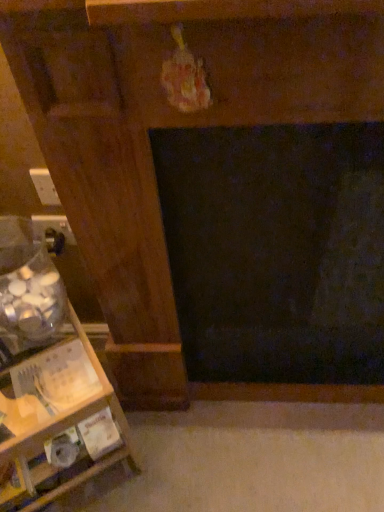
Locate an element on the screen. The height and width of the screenshot is (512, 384). wooden shelf at left is located at coordinates (57, 419).

Find the location of a particular element. wooden shelf at left is located at coordinates (57, 419).

Which is more to the left, wooden shelf at left or matte black outlet at lower left, which ranks as the first electric outlet in bottom-to-top order?

From the viewer's perspective, wooden shelf at left appears more on the left side.

Looking at this image, is wooden shelf at left thinner than matte black outlet at lower left, the first electric outlet when ordered from back to front?

In fact, wooden shelf at left might be wider than matte black outlet at lower left, the first electric outlet when ordered from back to front.

Who is bigger, wooden shelf at left or matte black outlet at lower left, the first electric outlet when ordered from back to front?

wooden shelf at left.

Can you tell me how much wooden shelf at left and matte black outlet at lower left, which is counted as the second electric outlet, starting from the top, differ in facing direction?

34.1 degrees separate the facing orientations of wooden shelf at left and matte black outlet at lower left, which is counted as the second electric outlet, starting from the top.

Can you confirm if wooden shelf at left is smaller than white plastic electric outlet at left, which is the second electric outlet in back-to-front order?

Incorrect, wooden shelf at left is not smaller in size than white plastic electric outlet at left, which is the second electric outlet in back-to-front order.

Does wooden shelf at left lie behind white plastic electric outlet at left, which is the first electric outlet from front to back?

No, wooden shelf at left is closer to the camera.

Is wooden shelf at left not near white plastic electric outlet at left, which is the first electric outlet from front to back?

No, wooden shelf at left is in close proximity to white plastic electric outlet at left, which is the first electric outlet from front to back.

Is white plastic electric outlet at left, marked as the second electric outlet in a bottom-to-top arrangement, at the back of wooden shelf at left?

No, wooden shelf at left is not facing the opposite direction of white plastic electric outlet at left, marked as the second electric outlet in a bottom-to-top arrangement.

Is white plastic electric outlet at left, marked as the second electric outlet in a bottom-to-top arrangement, positioned with its back to matte black outlet at lower left, the first electric outlet when ordered from back to front?

No, white plastic electric outlet at left, marked as the second electric outlet in a bottom-to-top arrangement, is not facing away from matte black outlet at lower left, the first electric outlet when ordered from back to front.

Who is taller, white plastic electric outlet at left, which is the second electric outlet in back-to-front order, or matte black outlet at lower left, which is counted as the second electric outlet, starting from the top?

With more height is white plastic electric outlet at left, which is the second electric outlet in back-to-front order.

Measure the distance between white plastic electric outlet at left, marked as the second electric outlet in a bottom-to-top arrangement, and matte black outlet at lower left, which is counted as the second electric outlet, starting from the top.

white plastic electric outlet at left, marked as the second electric outlet in a bottom-to-top arrangement, is 2.74 inches from matte black outlet at lower left, which is counted as the second electric outlet, starting from the top.

Who is bigger, white plastic electric outlet at left, marked as the second electric outlet in a bottom-to-top arrangement, or matte black outlet at lower left, the 2th electric outlet viewed from the front?

With larger size is matte black outlet at lower left, the 2th electric outlet viewed from the front.

From the image's perspective, would you say white plastic electric outlet at left, which is the second electric outlet in back-to-front order, is positioned over wooden shelf at left?

Indeed, from the image's perspective, white plastic electric outlet at left, which is the second electric outlet in back-to-front order, is shown above wooden shelf at left.

Which is less distant, (50, 186) or (61, 345)?

Point (50, 186) appears to be closer to the viewer than point (61, 345).

Is white plastic electric outlet at left, placed as the first electric outlet when sorted from top to bottom, with wooden shelf at left?

They are not placed beside each other.

Considering the sizes of objects white plastic electric outlet at left, marked as the second electric outlet in a bottom-to-top arrangement, and wooden shelf at left in the image provided, who is shorter, white plastic electric outlet at left, marked as the second electric outlet in a bottom-to-top arrangement, or wooden shelf at left?

With less height is white plastic electric outlet at left, marked as the second electric outlet in a bottom-to-top arrangement.

Between matte black outlet at lower left, which is counted as the second electric outlet, starting from the top, and white plastic electric outlet at left, marked as the second electric outlet in a bottom-to-top arrangement, which one has smaller size?

white plastic electric outlet at left, marked as the second electric outlet in a bottom-to-top arrangement.

Is matte black outlet at lower left, the 2th electric outlet viewed from the front, in contact with white plastic electric outlet at left, marked as the second electric outlet in a bottom-to-top arrangement?

Yes, matte black outlet at lower left, the 2th electric outlet viewed from the front, is beside white plastic electric outlet at left, marked as the second electric outlet in a bottom-to-top arrangement.

Is matte black outlet at lower left, the first electric outlet when ordered from back to front, positioned with its back to white plastic electric outlet at left, placed as the first electric outlet when sorted from top to bottom?

No, matte black outlet at lower left, the first electric outlet when ordered from back to front, is not facing the opposite direction of white plastic electric outlet at left, placed as the first electric outlet when sorted from top to bottom.

Visually, is matte black outlet at lower left, which is counted as the second electric outlet, starting from the top, positioned to the left or to the right of white plastic electric outlet at left, placed as the first electric outlet when sorted from top to bottom?

Clearly, matte black outlet at lower left, which is counted as the second electric outlet, starting from the top, is on the left of white plastic electric outlet at left, placed as the first electric outlet when sorted from top to bottom, in the image.

Consider the image. Is matte black outlet at lower left, which ranks as the first electric outlet in bottom-to-top order, to the left or to the right of wooden shelf at left in the image?

matte black outlet at lower left, which ranks as the first electric outlet in bottom-to-top order, is positioned on wooden shelf at left's right side.

Can you confirm if matte black outlet at lower left, which ranks as the first electric outlet in bottom-to-top order, is wider than wooden shelf at left?

No, matte black outlet at lower left, which ranks as the first electric outlet in bottom-to-top order, is not wider than wooden shelf at left.

Is matte black outlet at lower left, the 2th electric outlet viewed from the front, completely or partially outside of wooden shelf at left?

That's correct, matte black outlet at lower left, the 2th electric outlet viewed from the front, is outside of wooden shelf at left.

I want to click on furniture that is below the matte black outlet at lower left, the 2th electric outlet viewed from the front (from the image's perspective), so click(x=57, y=419).

Where is `the 2nd electric outlet above when counting from the wooden shelf at left (from the image's perspective)`? The image size is (384, 512). the 2nd electric outlet above when counting from the wooden shelf at left (from the image's perspective) is located at coordinates (44, 187).

Looking at the image, which one is located closer to wooden shelf at left, matte black outlet at lower left, the first electric outlet when ordered from back to front, or white plastic electric outlet at left, marked as the second electric outlet in a bottom-to-top arrangement?

matte black outlet at lower left, the first electric outlet when ordered from back to front.

Looking at the image, which one is located further to wooden shelf at left, white plastic electric outlet at left, which is the second electric outlet in back-to-front order, or matte black outlet at lower left, which is counted as the second electric outlet, starting from the top?

white plastic electric outlet at left, which is the second electric outlet in back-to-front order, lies further to wooden shelf at left than the other object.

From the image, which object appears to be nearer to matte black outlet at lower left, which is counted as the second electric outlet, starting from the top, white plastic electric outlet at left, marked as the second electric outlet in a bottom-to-top arrangement, or wooden shelf at left?

white plastic electric outlet at left, marked as the second electric outlet in a bottom-to-top arrangement, lies closer to matte black outlet at lower left, which is counted as the second electric outlet, starting from the top, than the other object.

Based on their spatial positions, is wooden shelf at left or matte black outlet at lower left, which is counted as the second electric outlet, starting from the top, further from white plastic electric outlet at left, which is the first electric outlet from front to back?

Among the two, wooden shelf at left is located further to white plastic electric outlet at left, which is the first electric outlet from front to back.

Which object lies nearer to the anchor point white plastic electric outlet at left, placed as the first electric outlet when sorted from top to bottom, matte black outlet at lower left, which is counted as the second electric outlet, starting from the top, or wooden shelf at left?

matte black outlet at lower left, which is counted as the second electric outlet, starting from the top.

When comparing their distances from matte black outlet at lower left, which ranks as the first electric outlet in bottom-to-top order, does wooden shelf at left or white plastic electric outlet at left, which is the second electric outlet in back-to-front order, seem further?

The object further to matte black outlet at lower left, which ranks as the first electric outlet in bottom-to-top order, is wooden shelf at left.

Where is `electric outlet between white plastic electric outlet at left, which is the first electric outlet from front to back, and wooden shelf at left, in the vertical direction`? The height and width of the screenshot is (512, 384). electric outlet between white plastic electric outlet at left, which is the first electric outlet from front to back, and wooden shelf at left, in the vertical direction is located at coordinates (54, 227).